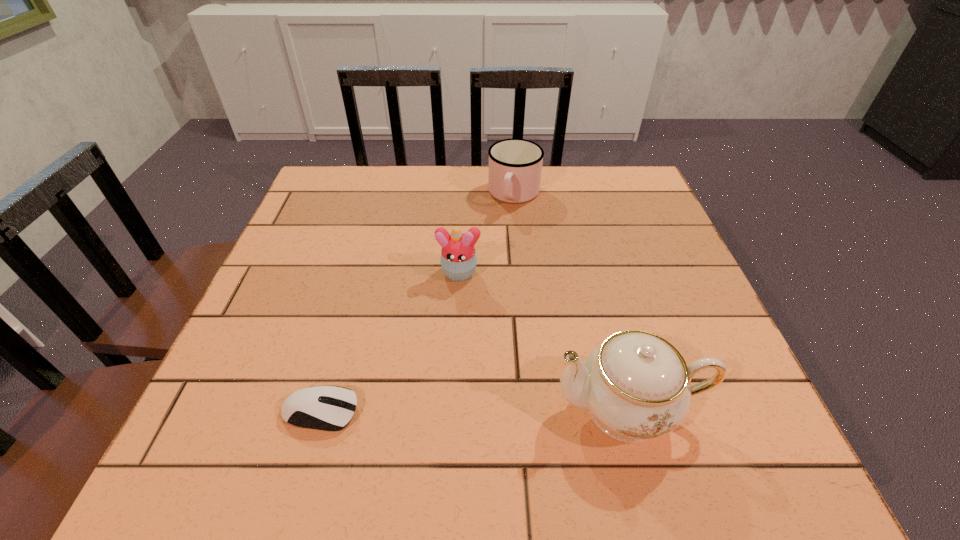
This screenshot has width=960, height=540. In order to click on mouse in this screenshot , I will do `click(317, 407)`.

You are a GUI agent. You are given a task and a screenshot of the screen. Output one action in this format:
    pyautogui.click(x=<x>, y=<y>)
    Task: Click on the leftmost object
    Image resolution: width=960 pixels, height=540 pixels.
    Given the screenshot: What is the action you would take?
    pyautogui.click(x=317, y=407)

Locate an element on the screen. The image size is (960, 540). chinaware is located at coordinates (636, 386).

Locate an element on the screen. The width and height of the screenshot is (960, 540). mug is located at coordinates (515, 165).

Find the location of a particular element. the third nearest object is located at coordinates (458, 260).

Identify the location of cupcake. The width and height of the screenshot is (960, 540). (458, 260).

You are a GUI agent. You are given a task and a screenshot of the screen. Output one action in this format:
    pyautogui.click(x=<x>, y=<y>)
    Task: Click on the vacant space located 0.060m on the left of the leftmost object
    This screenshot has height=540, width=960.
    Given the screenshot: What is the action you would take?
    pyautogui.click(x=248, y=411)

You are a GUI agent. You are given a task and a screenshot of the screen. Output one action in this format:
    pyautogui.click(x=<x>, y=<y>)
    Task: Click on the vacant space located at the spout of the tallest object
    The height and width of the screenshot is (540, 960).
    Given the screenshot: What is the action you would take?
    pyautogui.click(x=434, y=409)

Image resolution: width=960 pixels, height=540 pixels. In order to click on vacant space located at the spout of the tallest object in this screenshot , I will do `click(475, 409)`.

Find the location of `free region located at the spout of the tallest object`. free region located at the spout of the tallest object is located at coordinates (346, 409).